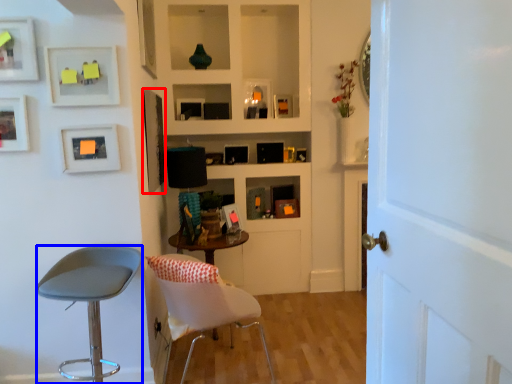
Question: Which object appears closest to the camera in this image, picture frame (highlighted by a red box) or chair (highlighted by a blue box)?

Choices:
 (A) picture frame
 (B) chair

Answer: (B)